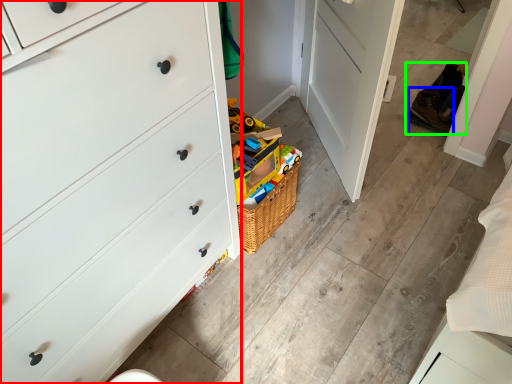
Question: Considering the real-world distances, which object is farthest from chest of drawers (highlighted by a red box)? shoe (highlighted by a blue box) or shoe (highlighted by a green box)?

Choices:
 (A) shoe
 (B) shoe

Answer: (A)